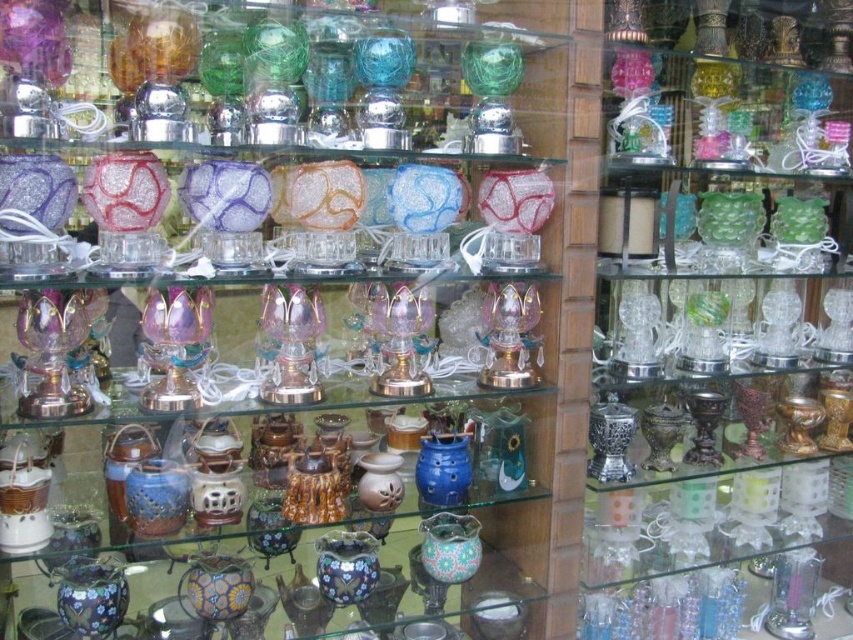
Is matte glass candle at center thinner than translucent glass candle at center?

No, matte glass candle at center is not thinner than translucent glass candle at center.

Can you confirm if matte glass candle at center is shorter than translucent glass candle at center?

Yes.

Locate an element on the screen. The image size is (853, 640). matte glass candle at center is located at coordinates (300, 317).

Who is higher up, matte glass candle at center or blue glossy vase at center?

matte glass candle at center is above.

Does point (19, 216) lie behind point (463, 486)?

That is False.

This screenshot has height=640, width=853. I want to click on matte glass candle at center, so click(300, 317).

Between point (671, 544) and point (469, 483), which one is positioned in front?

Point (469, 483) is in front.

Does point (657, 129) come closer to viewer compared to point (451, 456)?

No.

Does point (612, 307) lie in front of point (463, 452)?

No.

Identify the location of translucent glass candle at center. The width and height of the screenshot is (853, 640). (721, 323).